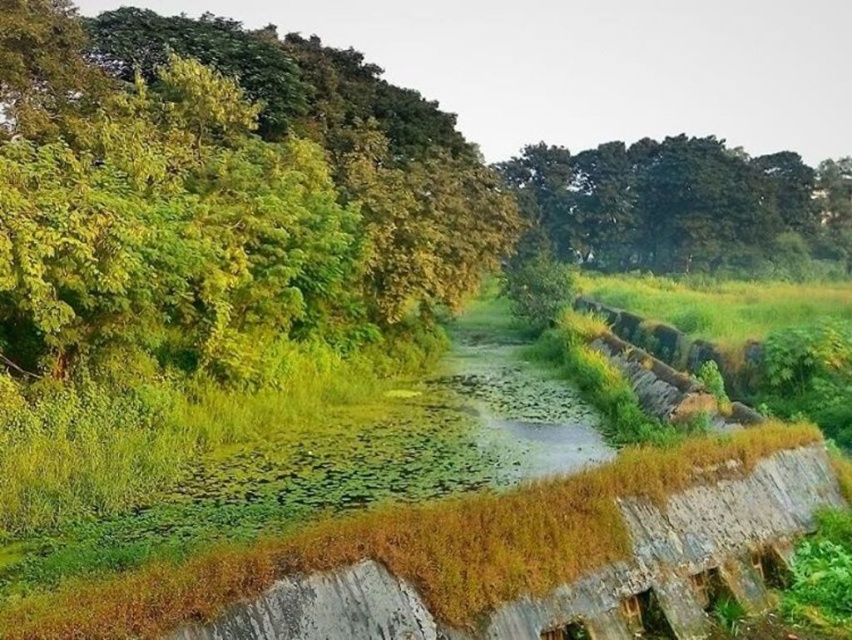
You are a GUI agent. You are given a task and a screenshot of the screen. Output one action in this format:
    pyautogui.click(x=<x>, y=<y>)
    Task: Click on the green leafy tree at left
    This screenshot has height=640, width=852.
    Given the screenshot: What is the action you would take?
    (219, 189)

Is point (422, 292) in front of point (799, 168)?

That is True.

This screenshot has width=852, height=640. Identify the location of green leafy tree at left. (219, 189).